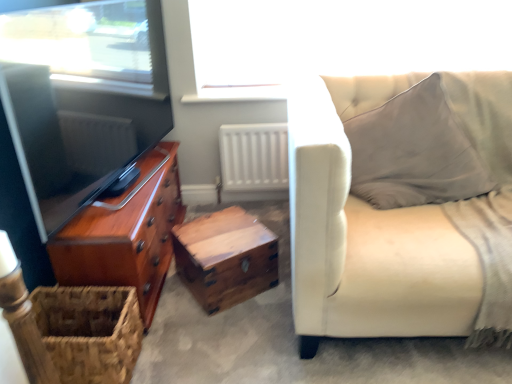
You are a GUI agent. You are given a task and a screenshot of the screen. Output one action in this format:
    pyautogui.click(x=<x>, y=<y>)
    Task: Click on the vacant area that lies between wooden trunk at center and woven brown basket at lower left
    The width and height of the screenshot is (512, 384).
    Given the screenshot: What is the action you would take?
    pyautogui.click(x=181, y=319)